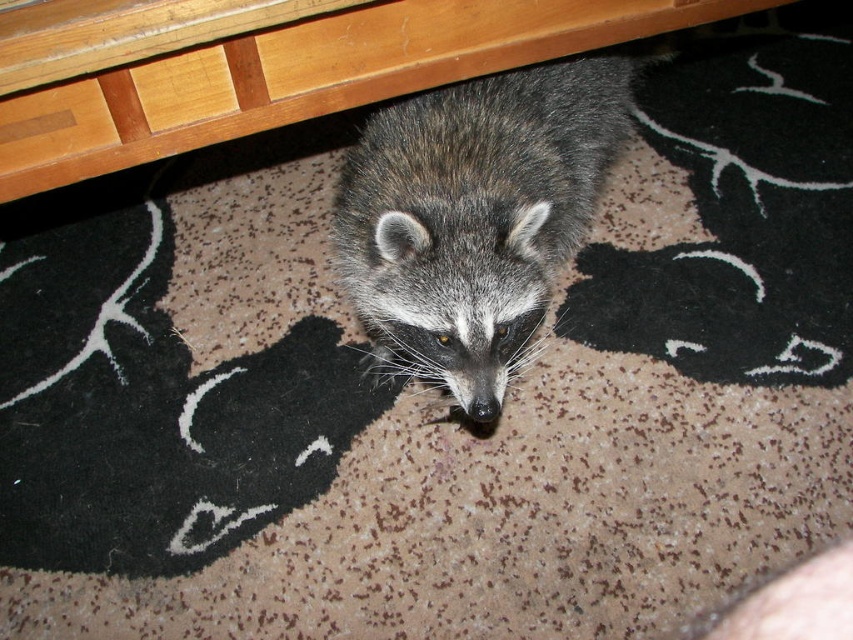
You are a drone operator trying to navigate through a room. You have two points marked on your map as reference points. The first point is at coordinates point (444, 93) and the second point is at point (22, 97). Your drone is currently at the second point. You need to move it to a position that is directly behind the first point. Which direction should you move the drone relative to the second point?

Since point (444, 93) is behind point (22, 97), you should move the drone in the direction away from the second point towards the first point to place it directly behind the first point.

You are a small robot with a width of 15 inches. You want to move from the fuzzy gray raccoon at center to the wooden drawer at upper left. Is there enough space for you to pass through the area between them?

The fuzzy gray raccoon at center is 20.85 inches away from the wooden drawer at upper left. Since the robot is 15 inches wide, there is enough space for it to pass through the area between them.

You are trying to reach the wooden drawer at upper center to retrieve a tool. The wooden table at upper center is blocking your path. Can you move around the table to access the drawer?

The wooden table at upper center is in front of the wooden drawer at upper center, so you can move around the table to access the drawer since it is blocking the direct path but not necessarily covering it entirely.